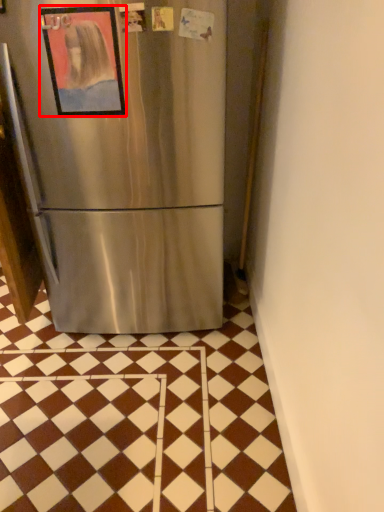
Question: In this image, where is picture frame (annotated by the red box) located relative to tile?

Choices:
 (A) right
 (B) left

Answer: (A)